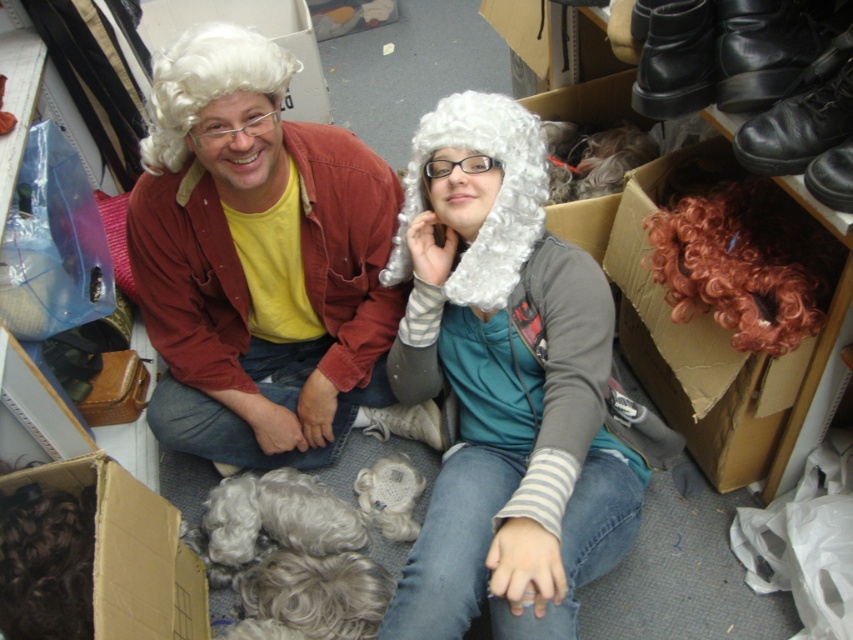
You are a costume designer preparing for a play and need to place the copper curly wig at upper right and the white curly wig at center in a display case. According to the image, which wig should be placed to the right side of the other?

The copper curly wig at upper right should be placed to the right side of the white curly wig at center, as it is positioned on the right side of the white curly wig at center in the image.

You are a costume designer who needs to place a new wig on the shelf behind the cardboard box at lower right and the copper curly wig at upper right. Which object should you move first to access the shelf?

You should move the cardboard box at lower right first because it is closer to you than the copper curly wig at upper right, which is further away.